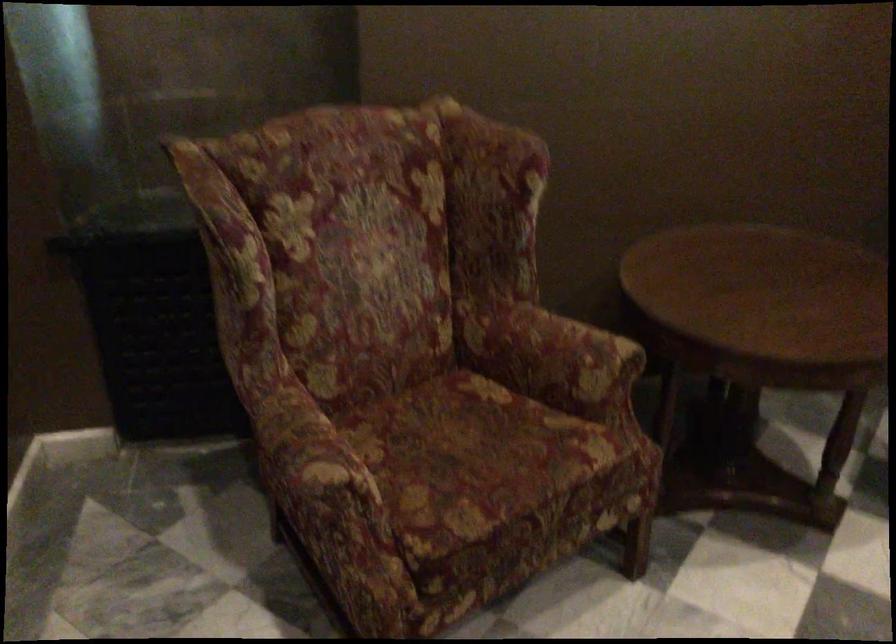
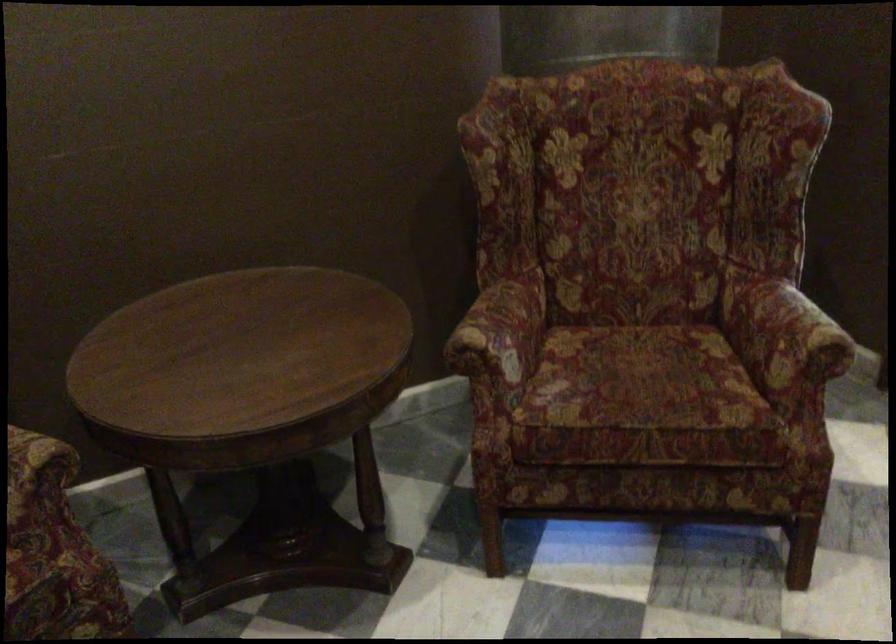
Question: The first image is from the beginning of the video and the second image is from the end. How did the camera likely rotate when shooting the video?

Choices:
 (A) Left
 (B) Right
 (C) Up
 (D) Down

Answer: (B)